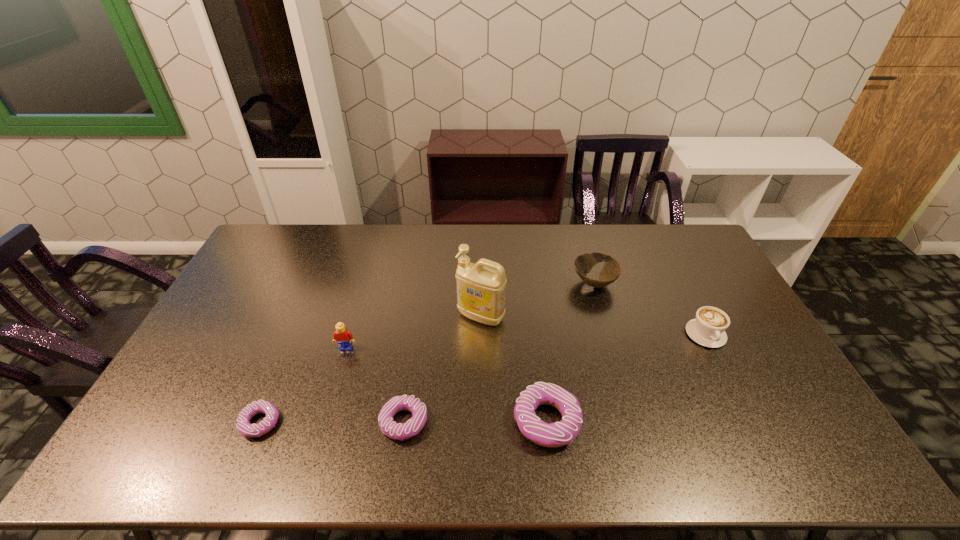
Please show where to add a doughnut on the right while keeping spacing even. Please provide its 2D coordinates. Your answer should be formatted as a tuple, i.e. [(x, y)], where the tuple contains the x and y coordinates of a point satisfying the conditions above.

[(690, 420)]